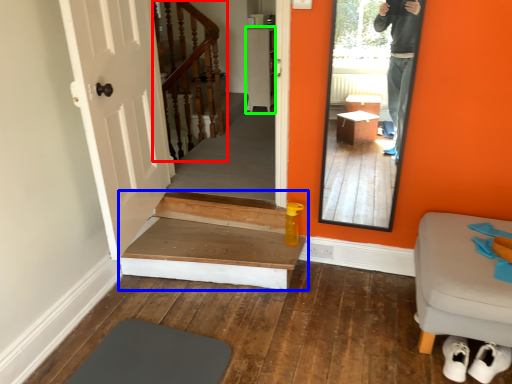
Question: Considering the real-world distances, which object is closest to stairs (highlighted by a red box)? stairs (highlighted by a blue box) or cabinetry (highlighted by a green box).

Choices:
 (A) stairs
 (B) cabinetry

Answer: (B)